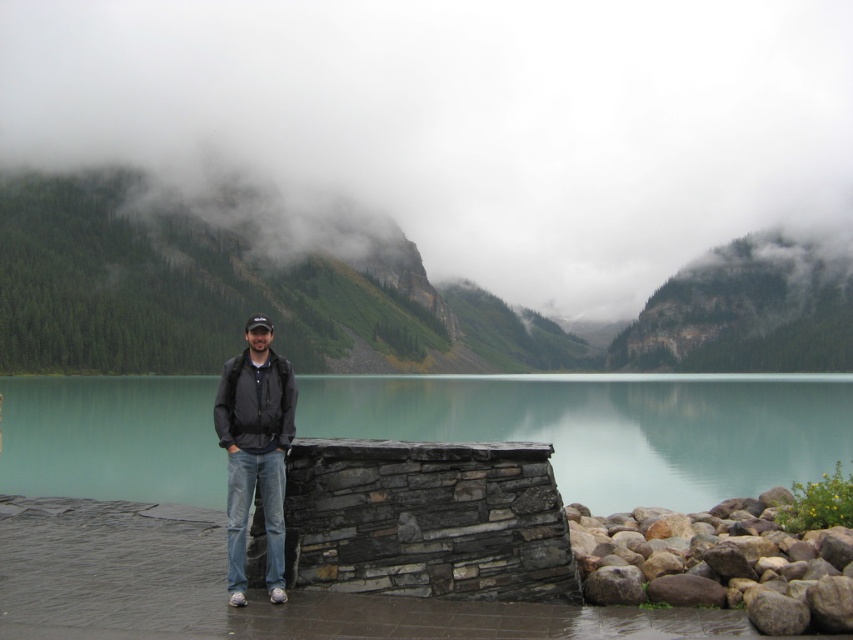
Question: Does green forested mountain at upper center have a smaller size compared to dark gray jacket at center?

Choices:
 (A) no
 (B) yes

Answer: (A)

Question: Estimate the real-world distances between objects in this image. Which object is closer to the dark gray jacket at center?

Choices:
 (A) green forested mountain at upper center
 (B) teal stone water at center

Answer: (B)

Question: Which is nearer to the green forested mountain at upper center?

Choices:
 (A) teal stone water at center
 (B) foggy misty mountain at upper center
 (C) dark gray jacket at center

Answer: (A)

Question: Which object is closer to the camera taking this photo?

Choices:
 (A) foggy misty mountain at upper center
 (B) dark gray jacket at center
 (C) brown rough rock at lower right

Answer: (C)

Question: Is foggy misty mountain at upper center bigger than teal stone water at center?

Choices:
 (A) yes
 (B) no

Answer: (A)

Question: Is green forested mountain at upper center further to the viewer compared to dark gray jacket at center?

Choices:
 (A) no
 (B) yes

Answer: (B)